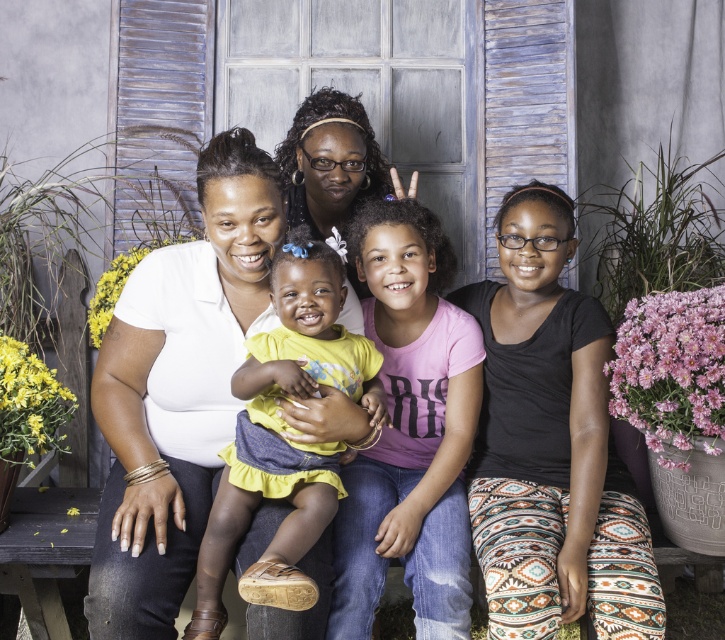
Between point (447, 352) and point (276, 600), which one is positioned in front?

Point (276, 600) is more forward.

Can you confirm if pink matte shirt at center is positioned to the right of yellow matte dress at center?

Yes, pink matte shirt at center is to the right of yellow matte dress at center.

Find the location of `pink matte shirt at center`. pink matte shirt at center is located at coordinates (410, 429).

I want to click on pink matte shirt at center, so click(x=410, y=429).

Looking at this image, does yellow matte dress at center have a larger size compared to white matte shirt at center?

Actually, yellow matte dress at center might be smaller than white matte shirt at center.

The width and height of the screenshot is (725, 640). What do you see at coordinates (281, 436) in the screenshot?
I see `yellow matte dress at center` at bounding box center [281, 436].

Locate an element on the screen. The image size is (725, 640). yellow matte dress at center is located at coordinates (281, 436).

Who is more distant from viewer, (x=399, y=204) or (x=132, y=596)?

The point (x=399, y=204) is more distant.

Is pink matte shirt at center in front of white matte shirt at center?

That is False.

Who is more forward, (347, 509) or (152, 600)?

Point (152, 600) is more forward.

Image resolution: width=725 pixels, height=640 pixels. Identify the location of pink matte shirt at center. (410, 429).